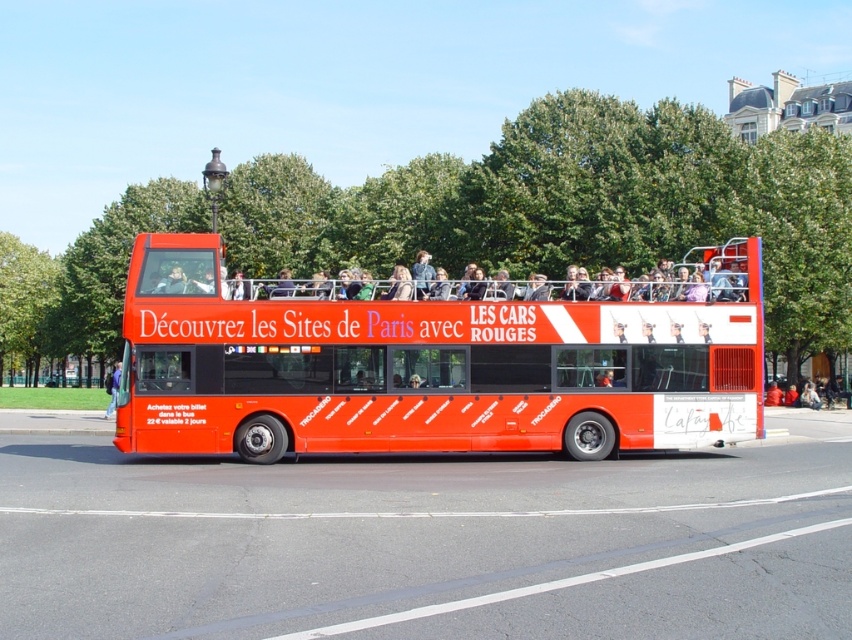
Is shiny red bus at center positioned behind green leafy tree at left?

No, shiny red bus at center is in front of green leafy tree at left.

Can you confirm if shiny red bus at center is positioned to the left of green leafy tree at left?

In fact, shiny red bus at center is to the right of green leafy tree at left.

This screenshot has height=640, width=852. I want to click on shiny red bus at center, so click(429, 368).

Is green leafy tree at center further to the viewer compared to shiny red bus at center?

Yes, green leafy tree at center is further from the viewer.

Between green leafy tree at center and shiny red bus at center, which one appears on the left side from the viewer's perspective?

green leafy tree at center is more to the left.

Where is `green leafy tree at center`? Image resolution: width=852 pixels, height=640 pixels. green leafy tree at center is located at coordinates (576, 205).

From the picture: Can you confirm if green leafy tree at center is thinner than green leafy tree at left?

Incorrect, green leafy tree at center's width is not less than green leafy tree at left's.

Who is more distant from viewer, [415,216] or [35,316]?

Point [35,316]

Where is `green leafy tree at center`? This screenshot has height=640, width=852. green leafy tree at center is located at coordinates (576, 205).